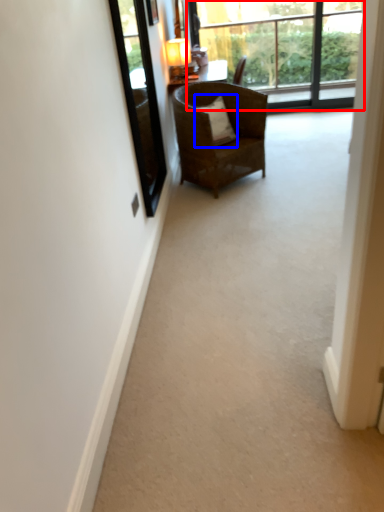
Question: Which object is closer to the camera taking this photo, window (highlighted by a red box) or pillow (highlighted by a blue box)?

Choices:
 (A) window
 (B) pillow

Answer: (B)